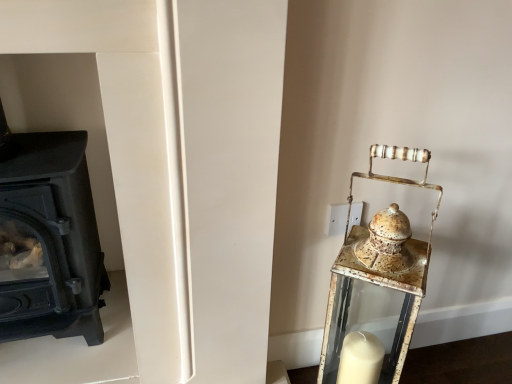
Question: From a real-world perspective, is black matte wood burning stove at left on rusty metal lantern at right?

Choices:
 (A) yes
 (B) no

Answer: (A)

Question: Considering the relative sizes of black matte wood burning stove at left and rusty metal lantern at right in the image provided, is black matte wood burning stove at left bigger than rusty metal lantern at right?

Choices:
 (A) no
 (B) yes

Answer: (B)

Question: From the image's perspective, would you say black matte wood burning stove at left is shown under rusty metal lantern at right?

Choices:
 (A) yes
 (B) no

Answer: (B)

Question: Considering the relative sizes of black matte wood burning stove at left and rusty metal lantern at right in the image provided, is black matte wood burning stove at left wider than rusty metal lantern at right?

Choices:
 (A) no
 (B) yes

Answer: (B)

Question: Can you confirm if black matte wood burning stove at left is positioned to the left of rusty metal lantern at right?

Choices:
 (A) yes
 (B) no

Answer: (A)

Question: From a real-world perspective, is black matte wood burning stove at left physically below rusty metal lantern at right?

Choices:
 (A) no
 (B) yes

Answer: (A)

Question: Does rusty metal lantern at right come in front of black matte wood burning stove at left?

Choices:
 (A) yes
 (B) no

Answer: (A)

Question: From the image's perspective, is rusty metal lantern at right above black matte wood burning stove at left?

Choices:
 (A) no
 (B) yes

Answer: (A)

Question: Is rusty metal lantern at right next to black matte wood burning stove at left and touching it?

Choices:
 (A) yes
 (B) no

Answer: (B)

Question: Does rusty metal lantern at right lie behind black matte wood burning stove at left?

Choices:
 (A) yes
 (B) no

Answer: (B)

Question: Is rusty metal lantern at right located outside black matte wood burning stove at left?

Choices:
 (A) no
 (B) yes

Answer: (B)

Question: Can you confirm if rusty metal lantern at right is bigger than black matte wood burning stove at left?

Choices:
 (A) yes
 (B) no

Answer: (B)

Question: From a real-world perspective, is black matte wood burning stove at left positioned above or below rusty metal lantern at right?

Choices:
 (A) above
 (B) below

Answer: (A)